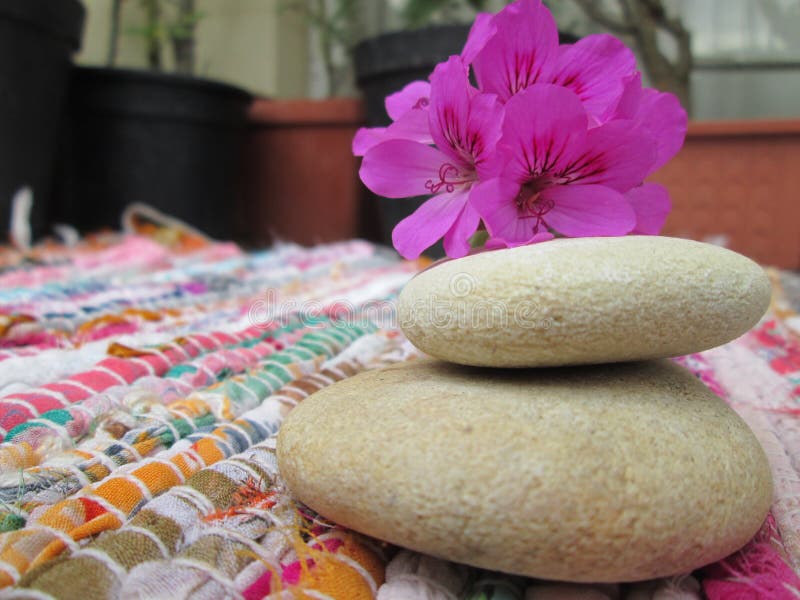
This screenshot has width=800, height=600. Find the location of `plant pots`. plant pots is located at coordinates (18, 65), (162, 166), (301, 158), (389, 56), (718, 173).